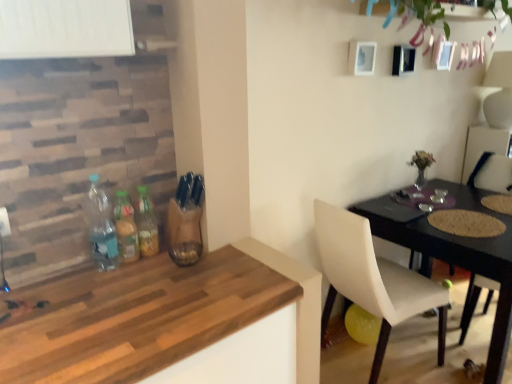
Identify the location of free space in front of transparent plastic bottle at left, arranged as the first bottle when viewed from the left. The image size is (512, 384). (103, 297).